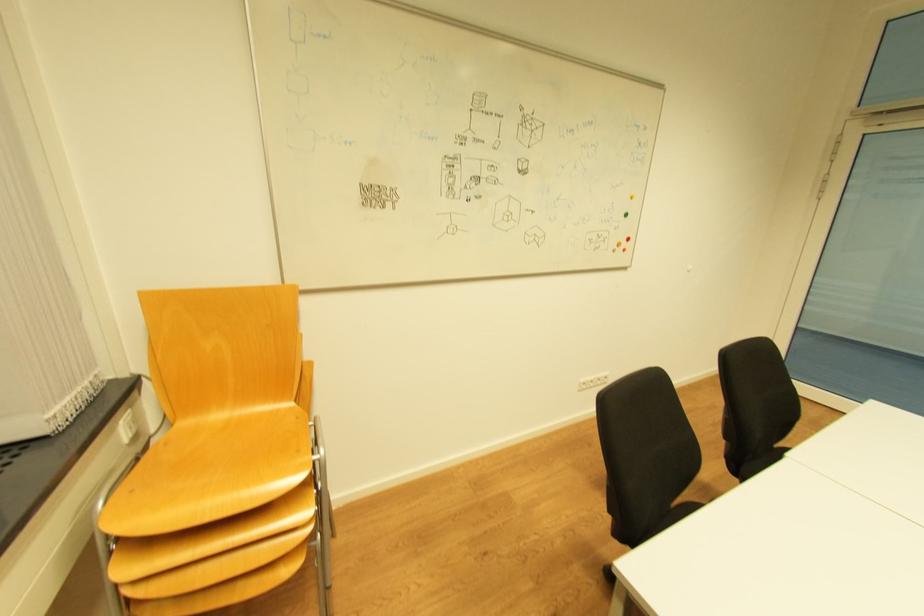
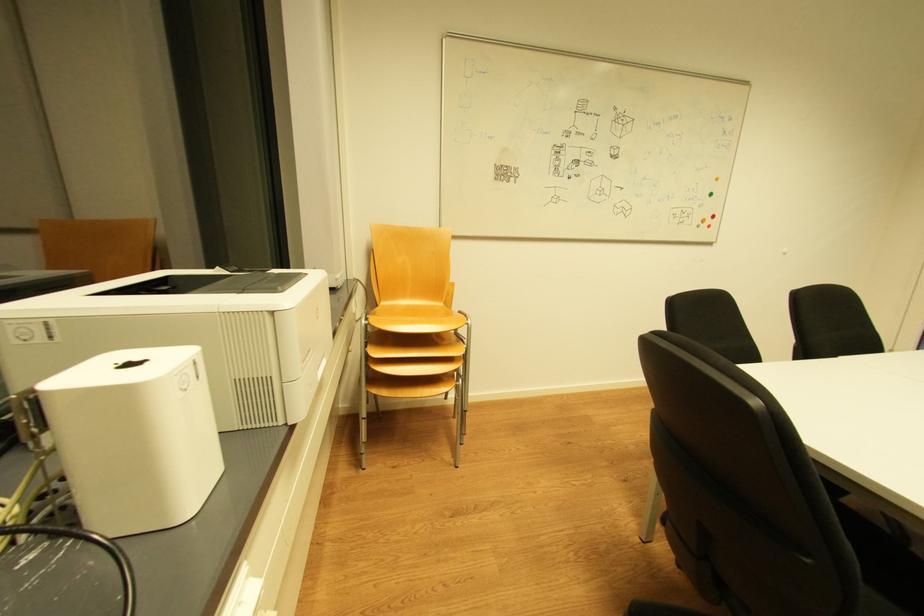
Question: The camera is either moving clockwise (left) or counter-clockwise (right) around the object. The first image is from the beginning of the video and the second image is from the end. Is the camera moving left or right when shooting the video?

Choices:
 (A) Left
 (B) Right

Answer: (B)